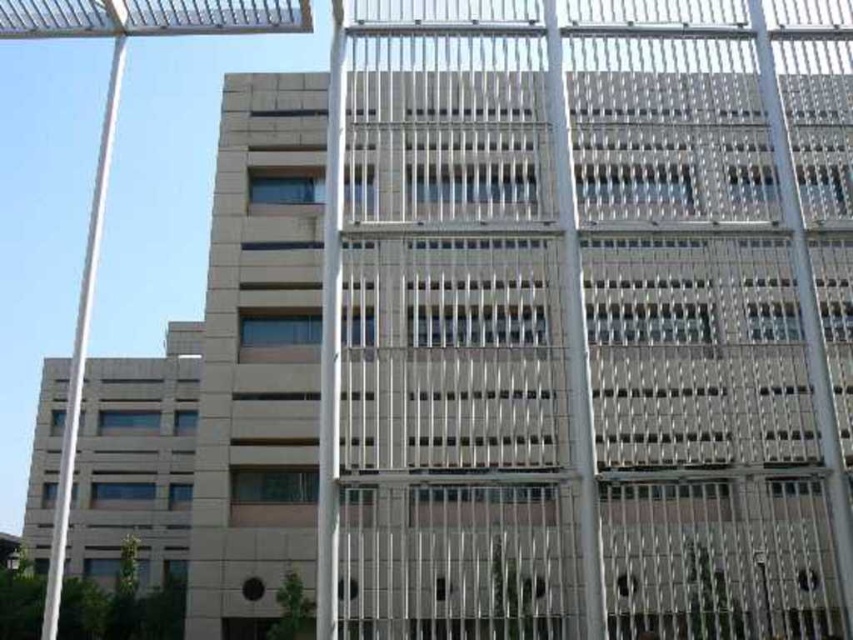
Does white metallic pole at center have a greater width compared to white metallic pole at left?

In fact, white metallic pole at center might be narrower than white metallic pole at left.

Based on the photo, is white metallic pole at center above white metallic pole at left?

No.

Which is in front, point (338, 72) or point (67, 467)?

Positioned in front is point (67, 467).

The image size is (853, 640). In order to click on white metallic pole at center in this screenshot , I will do `click(331, 339)`.

Between silver metallic pole at right and white metallic pole at left, which one is positioned higher?

silver metallic pole at right is higher up.

Between silver metallic pole at right and white metallic pole at left, which one is positioned lower?

white metallic pole at left is lower down.

The image size is (853, 640). I want to click on silver metallic pole at right, so click(x=807, y=310).

At what (x,y) coordinates should I click in order to perform the action: click on silver metallic pole at right. Please return your answer as a coordinate pair (x, y). This screenshot has height=640, width=853. Looking at the image, I should click on (807, 310).

Which is below, white metallic pole at center or silver metallic pole at right?

Positioned lower is white metallic pole at center.

In the scene shown: Is white metallic pole at center shorter than silver metallic pole at right?

No.

Where is `white metallic pole at center`? This screenshot has width=853, height=640. white metallic pole at center is located at coordinates (331, 339).